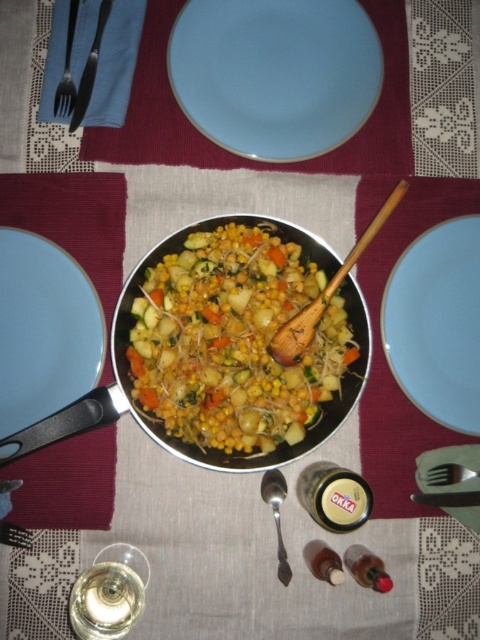
Question: Is satin silver spoon at center positioned before brushed metal spoon at lower center?

Choices:
 (A) yes
 (B) no

Answer: (A)

Question: Which object appears closest to the camera in this image?

Choices:
 (A) silver metallic fork at upper left
 (B) wooden spoon at center
 (C) brushed metal fork at lower right

Answer: (B)

Question: Based on their relative distances, which object is farther from the clear glass wine glass at lower left?

Choices:
 (A) metallic fork at upper left
 (B) brushed metal spoon at lower center
 (C) light blue ceramic plate at center

Answer: (C)

Question: Which object appears farthest from the camera in this image?

Choices:
 (A) light blue ceramic plate at right
 (B) satin silver fork at lower right
 (C) silver metallic frying pan at center

Answer: (B)

Question: Does wooden spoon at center lie behind satin silver fork at lower right?

Choices:
 (A) yes
 (B) no

Answer: (B)

Question: Can you confirm if clear glass wine glass at lower left is positioned to the right of wooden spoon at center?

Choices:
 (A) yes
 (B) no

Answer: (B)